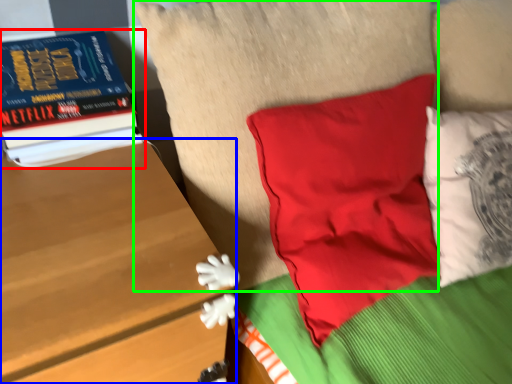
Question: Which object is positioned closest to book (highlighted by a red box)? Select from table (highlighted by a blue box) and pillow (highlighted by a green box).

Choices:
 (A) table
 (B) pillow

Answer: (A)